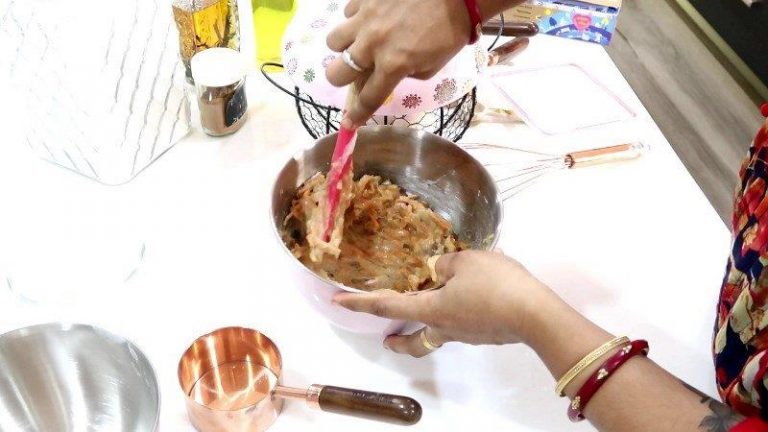
Where is `set of measuring spoons`? set of measuring spoons is located at coordinates (495, 109).